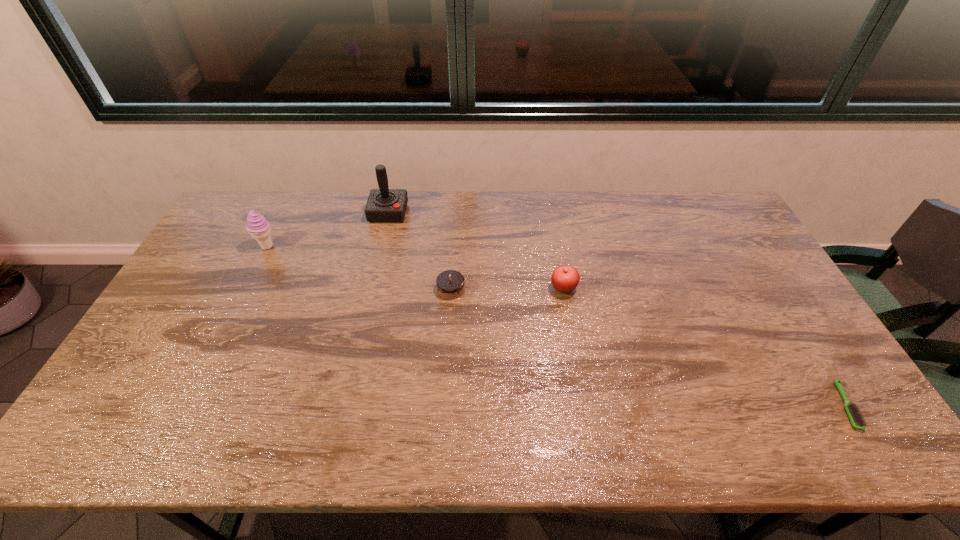
Identify the location of vacant space in between the second farthest object and the farthest object. (328, 230).

At what (x,y) coordinates should I click in order to perform the action: click on free space between the third object from left to right and the shortest object. Please return your answer as a coordinate pair (x, y). This screenshot has height=540, width=960. Looking at the image, I should click on (648, 348).

The image size is (960, 540). Identify the location of empty space that is in between the leftmost object and the joystick. (328, 230).

Image resolution: width=960 pixels, height=540 pixels. What are the coordinates of `free space between the chocolate cake and the hairbrush` in the screenshot? It's located at (648, 348).

Identify which object is the nearest to the icecream. Please provide its 2D coordinates. Your answer should be formatted as a tuple, i.e. [(x, y)], where the tuple contains the x and y coordinates of a point satisfying the conditions above.

[(383, 205)]

I want to click on object that ranks as the fourth closest to the nearest object, so click(x=259, y=228).

The image size is (960, 540). What are the coordinates of `free spot that satisfies the following two spatial constraints: 1. on the base of the fourth object from left to right; 2. on the left side of the second object from left to right` in the screenshot? It's located at (371, 289).

This screenshot has height=540, width=960. I want to click on vacant space that satisfies the following two spatial constraints: 1. on the base of the tallest object; 2. on the right side of the rightmost object, so click(343, 406).

The height and width of the screenshot is (540, 960). I want to click on free space that satisfies the following two spatial constraints: 1. on the base of the second object from right to left; 2. on the right side of the tallest object, so click(x=371, y=289).